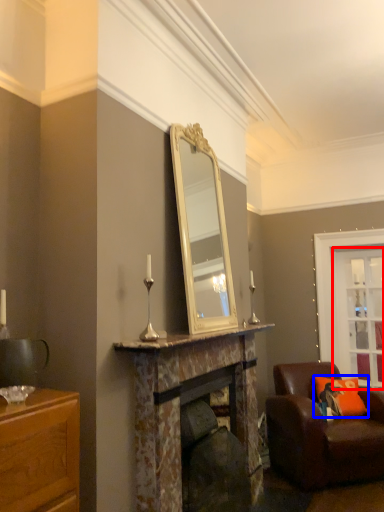
Question: Which point is closer to the camera, glass door (highlighted by a red box) or pillow (highlighted by a blue box)?

Choices:
 (A) glass door
 (B) pillow

Answer: (B)